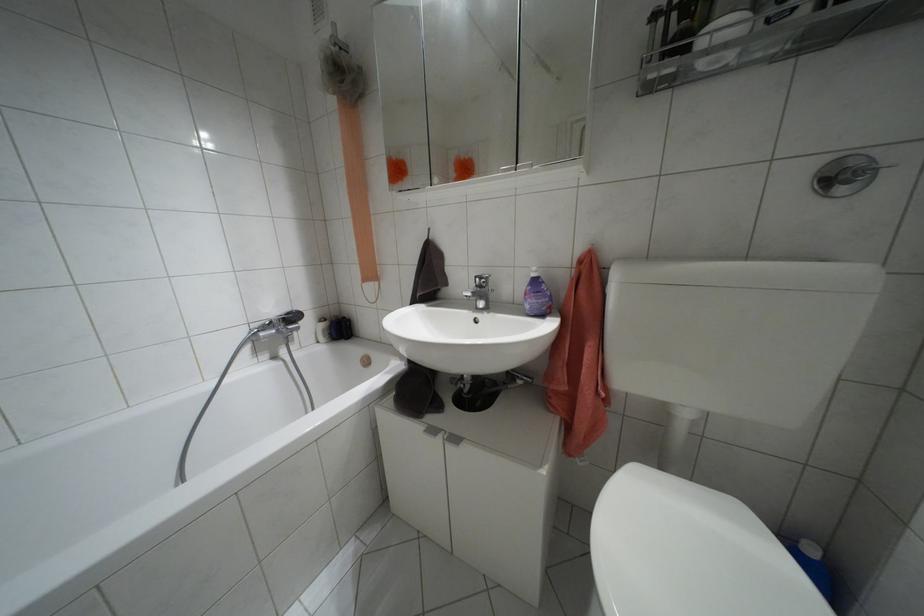
What do you see at coordinates (289, 315) in the screenshot?
I see `a bathtub faucet handle` at bounding box center [289, 315].